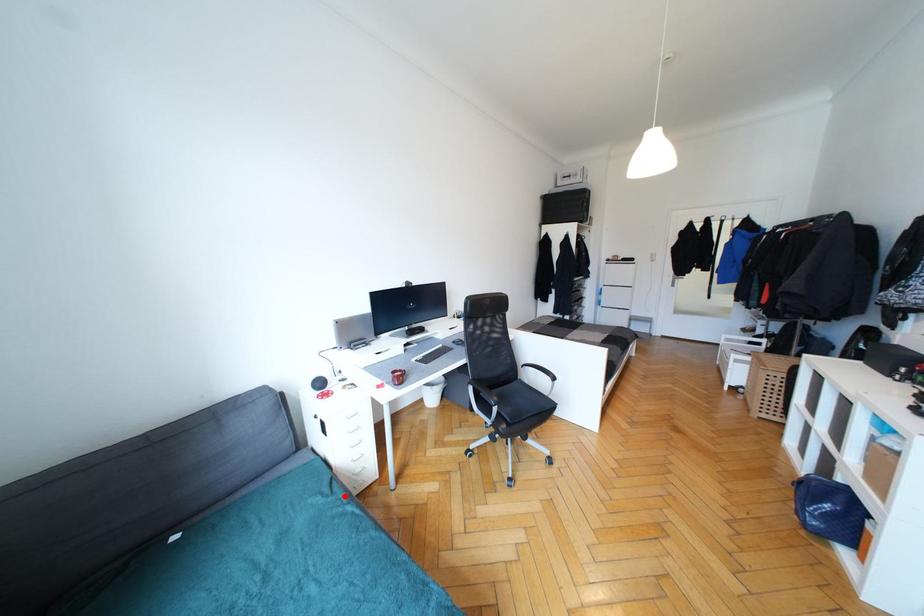
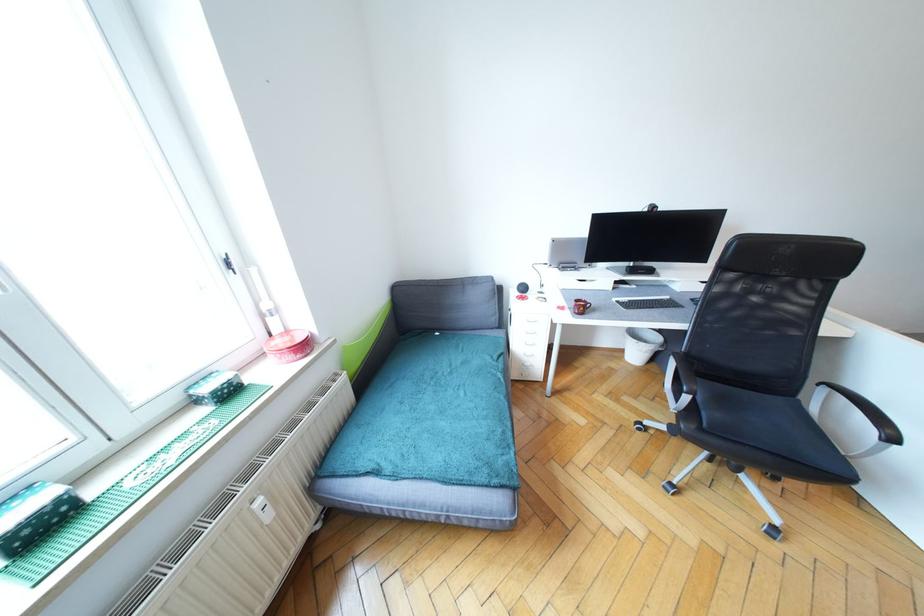
Question: I am providing you with two images of the same scene from different viewpoints. Image1 has a red point marked. In image2, the corresponding 3D location appears at what relative position? Reply with the corresponding letter.

Choices:
 (A) Closer
 (B) Farther

Answer: (B)